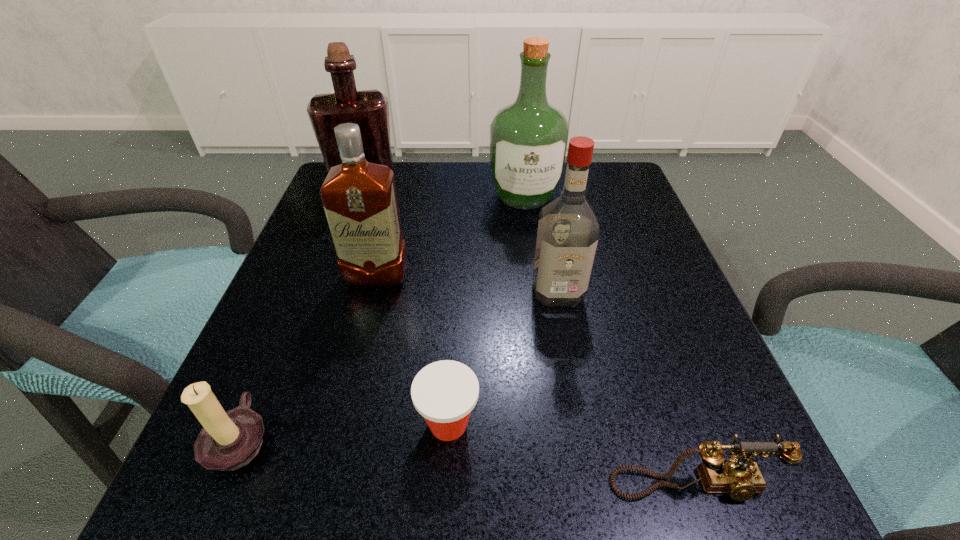
Locate an element on the screen. the fifth tallest object is located at coordinates (229, 440).

The image size is (960, 540). What are the coordinates of `telephone` in the screenshot? It's located at point(741,478).

This screenshot has height=540, width=960. In order to click on Dixie cup in this screenshot , I will do `click(445, 392)`.

You are a GUI agent. You are given a task and a screenshot of the screen. Output one action in this format:
    pyautogui.click(x=<x>, y=<y>)
    Task: Click on the free space located 0.300m on the wick of the candle holder
    The image size is (960, 540).
    Given the screenshot: What is the action you would take?
    (494, 438)

Where is `free point located on the left of the Dixie cup`? The image size is (960, 540). free point located on the left of the Dixie cup is located at coordinates click(360, 424).

Where is `candle holder that is at the near edge`? The image size is (960, 540). candle holder that is at the near edge is located at coordinates (229, 440).

Find the location of a particular element. Image resolution: width=960 pixels, height=540 pixels. telephone situated at the near edge is located at coordinates point(741,478).

You are a GUI agent. You are given a task and a screenshot of the screen. Output one action in this format:
    pyautogui.click(x=<x>, y=<y>)
    Task: Click on the Dixie cup situated at the near edge
    This screenshot has height=540, width=960.
    Given the screenshot: What is the action you would take?
    pyautogui.click(x=445, y=392)

Identify the location of candle holder located in the left edge section of the desktop. pyautogui.click(x=229, y=440).

This screenshot has width=960, height=540. Identify the location of object that is at the right edge. (741, 478).